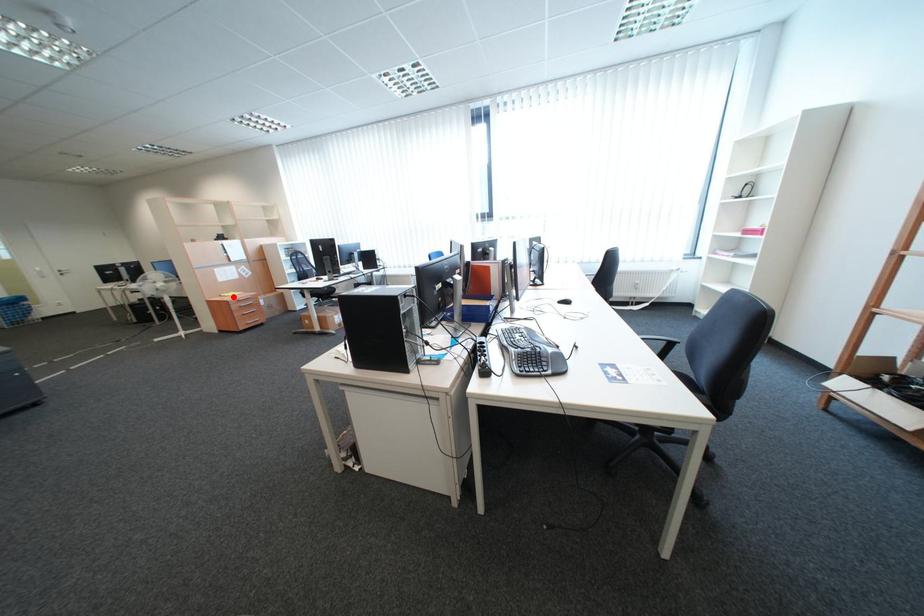
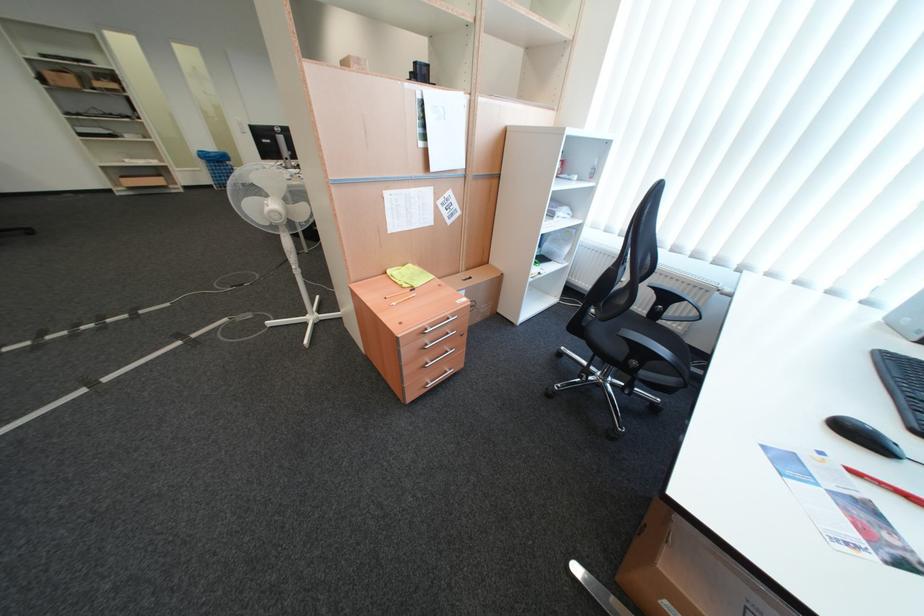
Question: I am providing you with two images of the same scene from different viewpoints. Image1 has a red point marked. In image2, the corresponding 3D location appears at what relative position? Reply with the corresponding letter.

Choices:
 (A) Closer
 (B) Farther

Answer: (B)